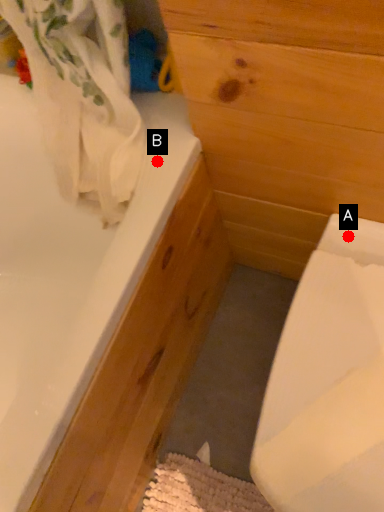
Question: Two points are circled on the image, labeled by A and B beside each circle. Which point is farther to the camera?

Choices:
 (A) A is further
 (B) B is further

Answer: (A)